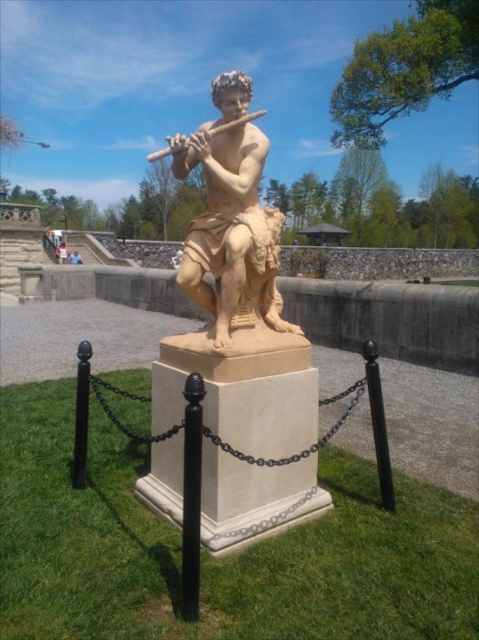
You are standing in front of the statue and want to take a photo of the black metal pole at center. If your camera has a maximum focus range of 7 feet, will you need to adjust your position to capture it clearly?

The black metal pole at center is 7.01 feet away from the camera. Since the maximum focus range is 7 feet, you need to move slightly closer to ensure the black metal pole at center is within the camera range.